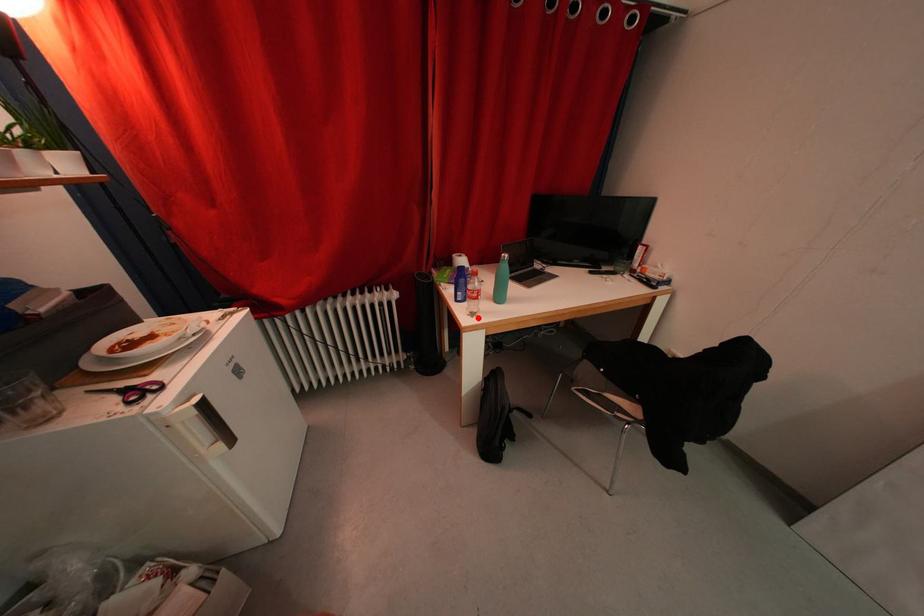
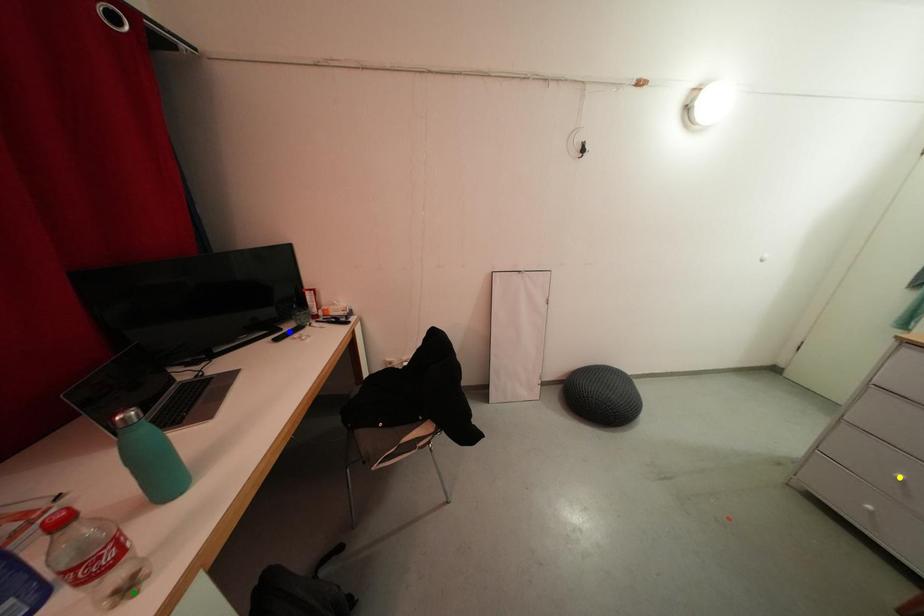
Question: I am providing you with two images of the same scene from different viewpoints. A red point is marked on the first image. You are given multiple points on the second image. In image 2, which mark is for the same physical point as the one in image 1?

Choices:
 (A) green point
 (B) yellow point
 (C) blue point

Answer: (A)